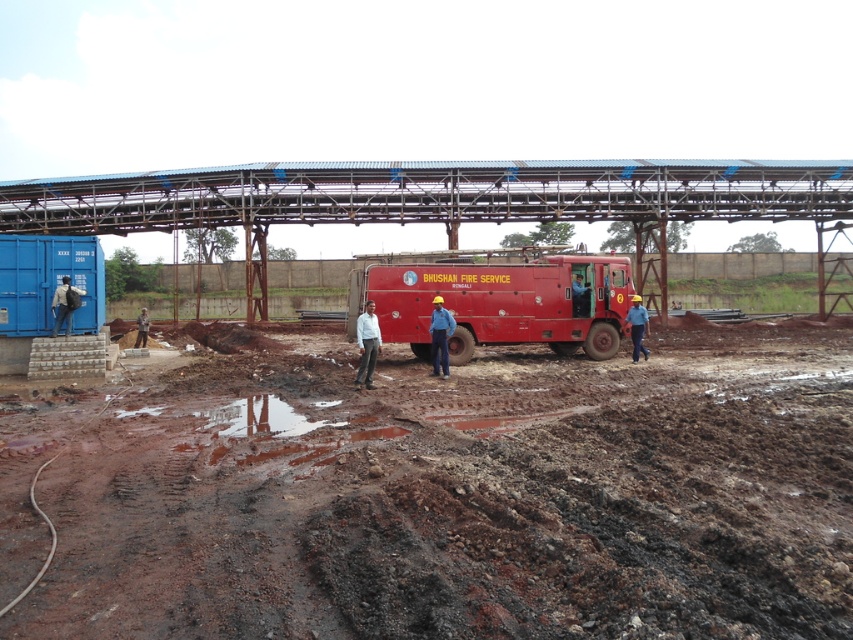
You are a construction worker who needs to retrieve your hard hat at center. The red matte fire truck at center is blocking your path. Can you walk around the truck to reach your hard hat?

The red matte fire truck at center is positioned over hard hat at center, meaning the truck is directly above the hard hat. Since the hard hat is underneath the truck, you cannot walk around it as the truck is blocking the path completely.

You are a construction worker who needs to carry a hard hat to the red matte fire truck at center. Given that the hard hat at center is smaller than the fire truck, can you estimate how much space you would need to place the hard hat on the fire truck?

The red matte fire truck at center is larger in size than the hard hat at center. Therefore, there should be sufficient space to place the hard hat on the fire truck.

You are a construction worker who just arrived at the site. You see the brown soil at center and the hard hat at center. Which object is more to the right?

The brown soil at center is positioned on the right side of hard hat at center, so the brown soil at center is more to the right.